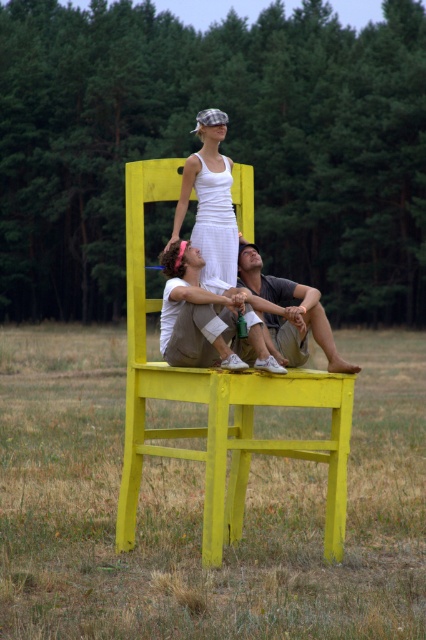
In the scene shown: Who is positioned more to the right, matte gray shirt at lower center or white cotton dress at center?

Positioned to the right is matte gray shirt at lower center.

In the scene shown: Can you confirm if matte gray shirt at lower center is positioned to the left of white cotton dress at center?

No, matte gray shirt at lower center is not to the left of white cotton dress at center.

In order to click on matte gray shirt at lower center in this screenshot , I will do click(287, 314).

Is yellow wood chair at center in front of white cotton dress at center?

Yes, it is.

Which of these two, yellow wood chair at center or white cotton dress at center, stands shorter?

white cotton dress at center

What do you see at coordinates (201, 509) in the screenshot? The image size is (426, 640). I see `yellow wood chair at center` at bounding box center [201, 509].

What are the coordinates of `yellow wood chair at center` in the screenshot? It's located at (201, 509).

Does point (178, 380) lie behind point (227, 236)?

No.

Describe the element at coordinates (215, 403) in the screenshot. The width and height of the screenshot is (426, 640). I see `yellow painted wood chair at center` at that location.

Find the location of a particular element. This screenshot has height=640, width=426. yellow painted wood chair at center is located at coordinates (215, 403).